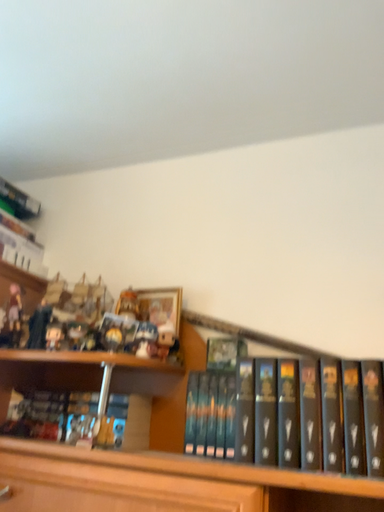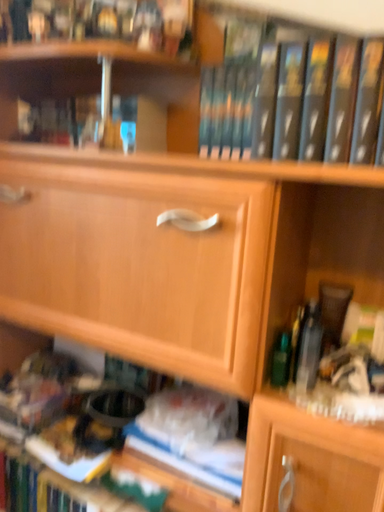
Question: How did the camera likely rotate when shooting the video?

Choices:
 (A) rotated upward
 (B) rotated downward

Answer: (B)